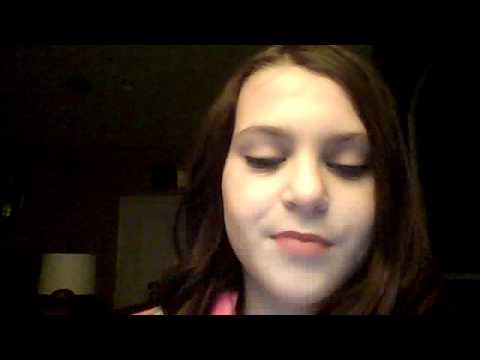
This screenshot has height=360, width=480. Identify the location of lampshade. (72, 274).